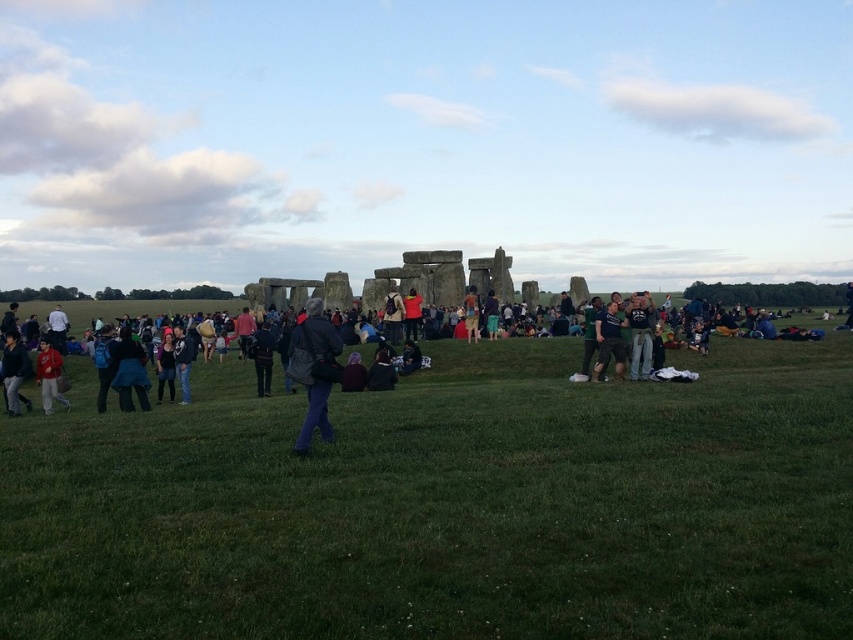
Question: Can you confirm if dark blue shirt at center is smaller than dark gray jacket at center?

Choices:
 (A) yes
 (B) no

Answer: (B)

Question: Which object is positioned farthest from the dark blue jacket at lower left?

Choices:
 (A) matte red jacket at center
 (B) dark gray jacket at center
 (C) dark gray fabric jacket at center

Answer: (A)

Question: Which of these objects is positioned farthest from the dark blue backpack at lower left?

Choices:
 (A) matte red jacket at lower left
 (B) dark blue shirt at center
 (C) dark blue jeans at center
 (D) green grassy field at center

Answer: (C)

Question: Is dark blue jacket at lower left smaller than dark blue backpack at lower left?

Choices:
 (A) no
 (B) yes

Answer: (B)

Question: Does dark blue jeans at center come in front of matte black jacket at center?

Choices:
 (A) yes
 (B) no

Answer: (A)

Question: Which point is farther from the camera taking this photo?

Choices:
 (A) (637, 340)
 (B) (120, 390)
 (C) (28, 364)

Answer: (A)